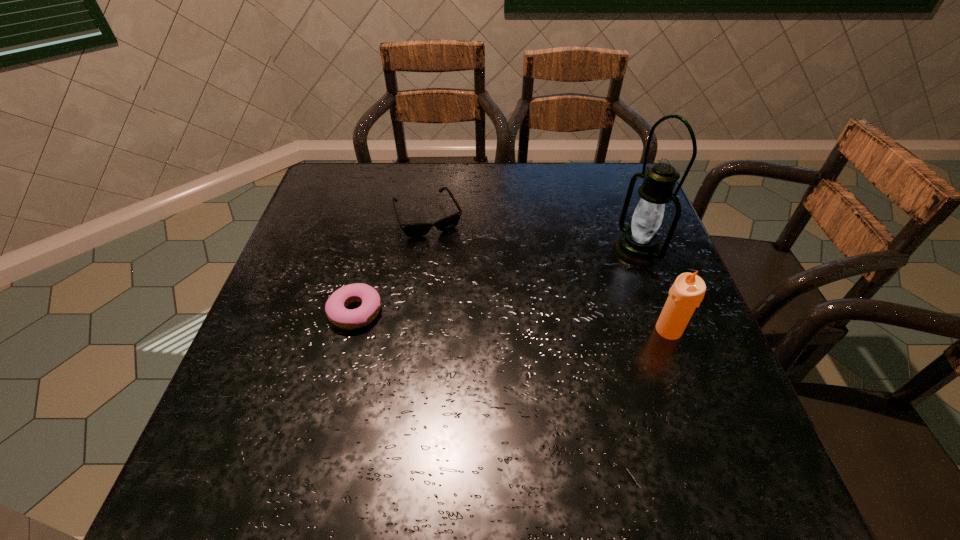
Where is `free space on the desktop that is between the doughnut and the third shortest object and is positioned on the side where the lantern emits light`? free space on the desktop that is between the doughnut and the third shortest object and is positioned on the side where the lantern emits light is located at coordinates (466, 318).

Locate an element on the screen. The height and width of the screenshot is (540, 960). free spot on the desktop that is between the doughnut and the second tallest object and is positioned on the front-facing side of the sunglasses is located at coordinates (474, 319).